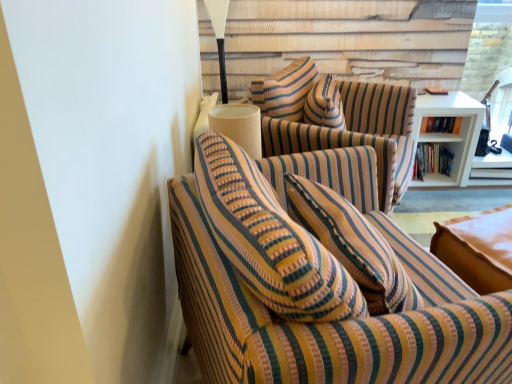
Question: Does striped fabric swivel chair at center come behind hardcover book at upper right, the 1th book positioned from the top?

Choices:
 (A) no
 (B) yes

Answer: (A)

Question: Does striped fabric swivel chair at center have a larger size compared to hardcover book at upper right, which is the 2th book from bottom to top?

Choices:
 (A) no
 (B) yes

Answer: (B)

Question: From the image's perspective, does striped fabric swivel chair at center appear higher than hardcover book at upper right, which is the 2th book from bottom to top?

Choices:
 (A) yes
 (B) no

Answer: (B)

Question: Can you confirm if striped fabric swivel chair at center is positioned to the right of hardcover book at upper right, which is the 2th book from bottom to top?

Choices:
 (A) yes
 (B) no

Answer: (B)

Question: Can you confirm if striped fabric swivel chair at center is shorter than hardcover book at upper right, which is the 2th book from bottom to top?

Choices:
 (A) yes
 (B) no

Answer: (B)

Question: Is striped fabric swivel chair at center beside hardcover book at upper right, which is the 2th book from bottom to top?

Choices:
 (A) no
 (B) yes

Answer: (A)

Question: Can you confirm if hardcover books at right, the 1th book when ordered from bottom to top, is wider than striped fabric swivel chair at center?

Choices:
 (A) yes
 (B) no

Answer: (B)

Question: Is hardcover books at right, the 1th book when ordered from bottom to top, bigger than striped fabric swivel chair at center?

Choices:
 (A) no
 (B) yes

Answer: (A)

Question: Does hardcover books at right, the 1th book when ordered from bottom to top, appear on the right side of striped fabric swivel chair at center?

Choices:
 (A) yes
 (B) no

Answer: (A)

Question: Can we say hardcover books at right, the 1th book when ordered from bottom to top, lies outside striped fabric swivel chair at center?

Choices:
 (A) no
 (B) yes

Answer: (B)

Question: Considering the relative sizes of hardcover books at right, acting as the second book starting from the top, and striped fabric swivel chair at center in the image provided, is hardcover books at right, acting as the second book starting from the top, taller than striped fabric swivel chair at center?

Choices:
 (A) yes
 (B) no

Answer: (B)

Question: From the image's perspective, is hardcover books at right, acting as the second book starting from the top, above striped fabric swivel chair at center?

Choices:
 (A) no
 (B) yes

Answer: (B)

Question: Can you confirm if hardcover books at right, the 1th book when ordered from bottom to top, is positioned to the left of striped fabric couch at left?

Choices:
 (A) yes
 (B) no

Answer: (B)